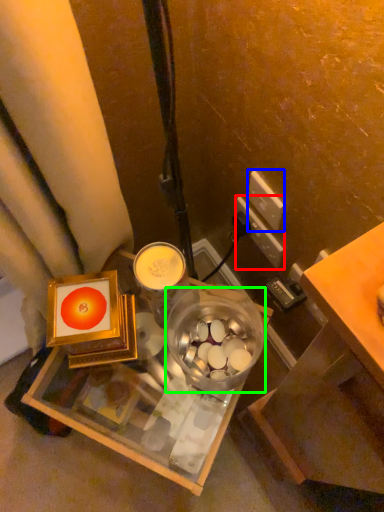
Question: Which object is the farthest from power outlet (highlighted by a red box)? Choose among these: power outlet (highlighted by a blue box) or glass bowl (highlighted by a green box).

Choices:
 (A) power outlet
 (B) glass bowl

Answer: (B)